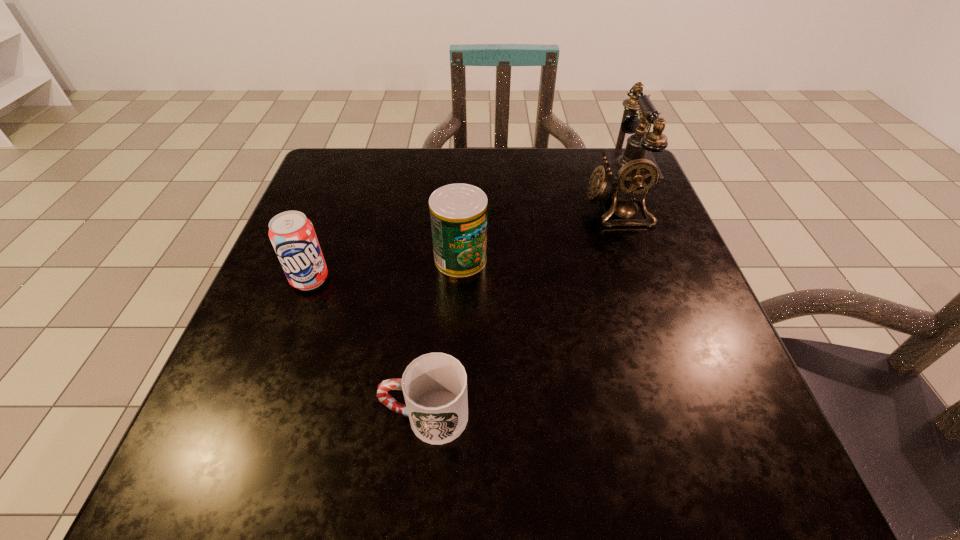
Identify the location of free space at the left edge of the desktop. This screenshot has width=960, height=540. (294, 409).

In the image, there is a desktop. At what (x,y) coordinates should I click in order to perform the action: click on free region at the right edge. Please return your answer as a coordinate pair (x, y). The height and width of the screenshot is (540, 960). Looking at the image, I should click on (714, 366).

Image resolution: width=960 pixels, height=540 pixels. What are the coordinates of `blank area at the far left corner` in the screenshot? It's located at (373, 187).

In the image, there is a desktop. Where is `free space at the near left corner`? The height and width of the screenshot is (540, 960). free space at the near left corner is located at coordinates (243, 456).

Where is `vacant space at the near right corner`? The image size is (960, 540). vacant space at the near right corner is located at coordinates (663, 446).

Where is `free space between the soda can and the shortest object`? The image size is (960, 540). free space between the soda can and the shortest object is located at coordinates (368, 348).

The height and width of the screenshot is (540, 960). I want to click on free space between the nearest object and the can, so pyautogui.click(x=444, y=338).

This screenshot has width=960, height=540. Find the location of `free spot between the rightmost object and the can`. free spot between the rightmost object and the can is located at coordinates (538, 232).

Locate an element on the screen. The width and height of the screenshot is (960, 540). vacant point located between the soda can and the nearest object is located at coordinates (368, 348).

This screenshot has width=960, height=540. In order to click on free point between the nearest object and the leftmost object in this screenshot , I will do `click(368, 348)`.